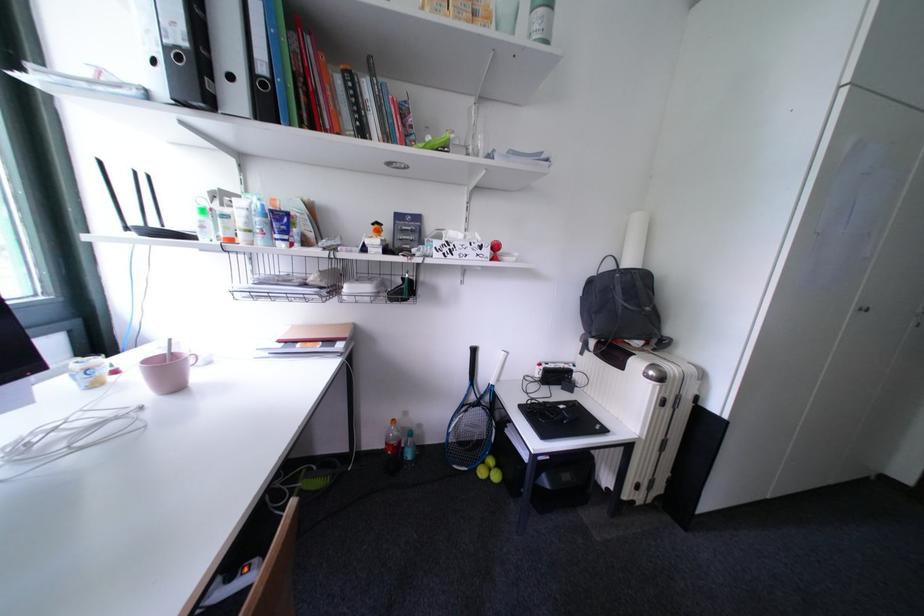
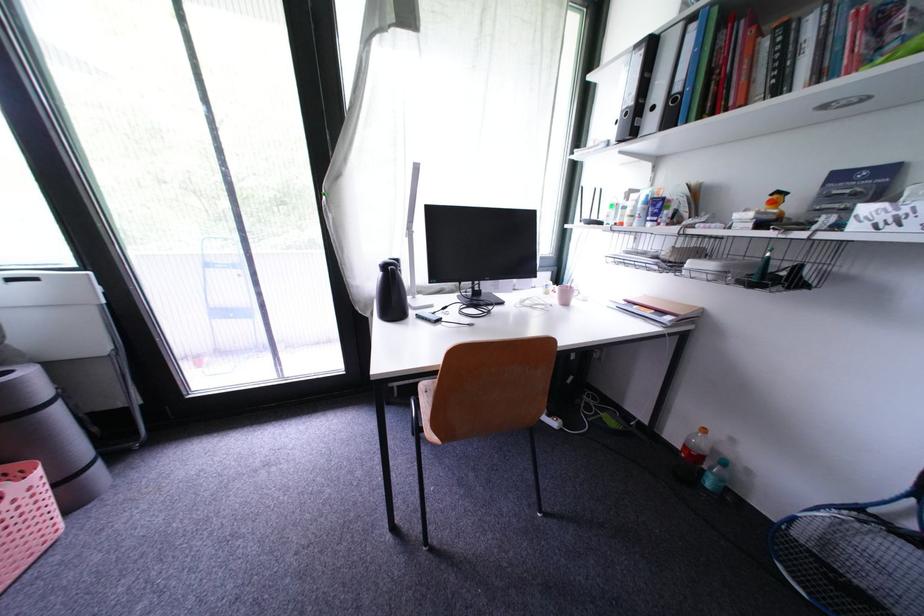
The point at (x=417, y=458) is marked in the first image. Where is the corresponding point in the second image?

(718, 485)